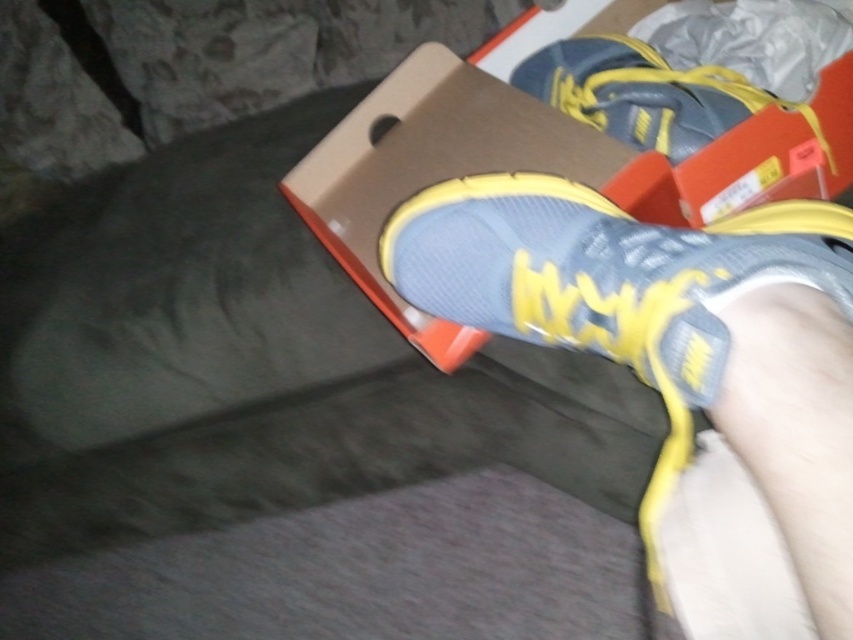
The image size is (853, 640). What do you see at coordinates (543, 154) in the screenshot? I see `matte cardboard shoebox at center` at bounding box center [543, 154].

Identify the location of matte cardboard shoebox at center. tap(543, 154).

Does matte cardboard shoebox at center have a greater height compared to matte blue sneaker at upper center?

Indeed, matte cardboard shoebox at center has a greater height compared to matte blue sneaker at upper center.

Locate an element on the screen. This screenshot has width=853, height=640. matte cardboard shoebox at center is located at coordinates (543, 154).

Based on the photo, is matte blue shoe at center further to camera compared to matte blue sneaker at upper center?

No, it is not.

Which is more to the left, matte blue shoe at center or matte blue sneaker at upper center?

matte blue shoe at center is more to the left.

Locate an element on the screen. matte blue shoe at center is located at coordinates (602, 269).

You are a GUI agent. You are given a task and a screenshot of the screen. Output one action in this format:
    pyautogui.click(x=<x>, y=<y>)
    Task: Click on the matte blue shoe at center
    This screenshot has width=853, height=640.
    Given the screenshot: What is the action you would take?
    pyautogui.click(x=602, y=269)